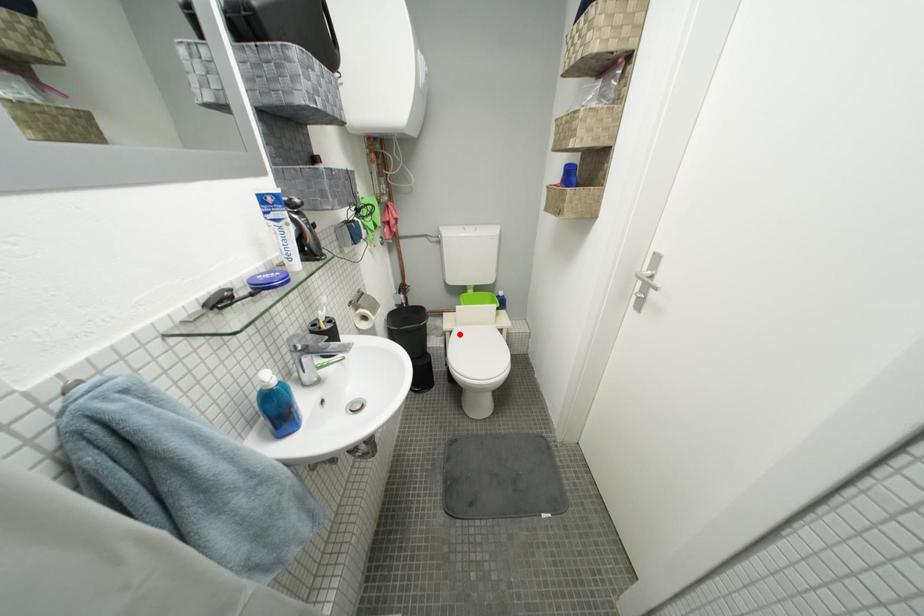
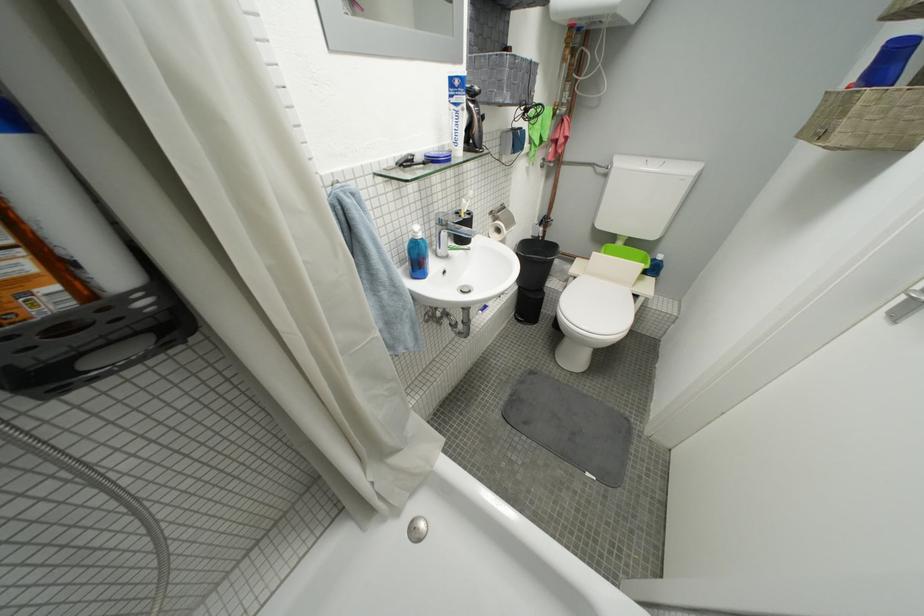
Where in the second image is the point corresponding to the highlighted location from the first image?

(584, 281)